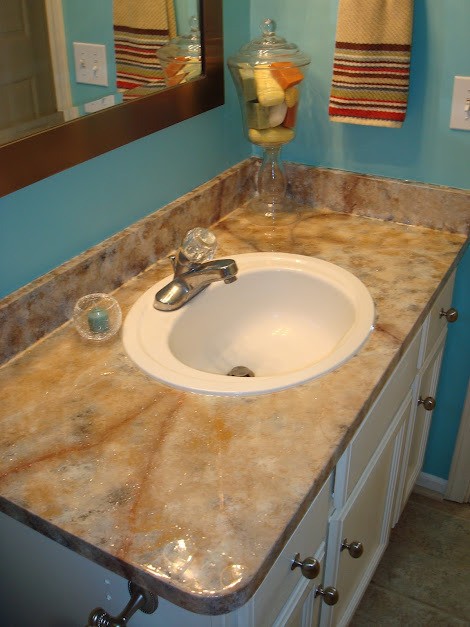
Image resolution: width=470 pixels, height=627 pixels. In order to click on glass container in this screenshot , I will do `click(271, 76)`.